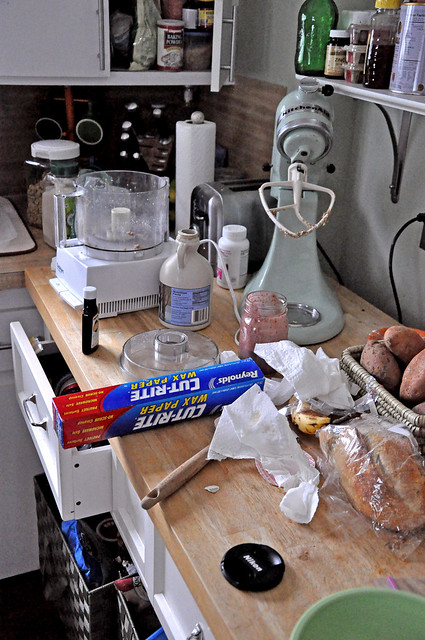
This screenshot has height=640, width=425. What are the coordinates of `mixer` in the screenshot? It's located at (73, 271).